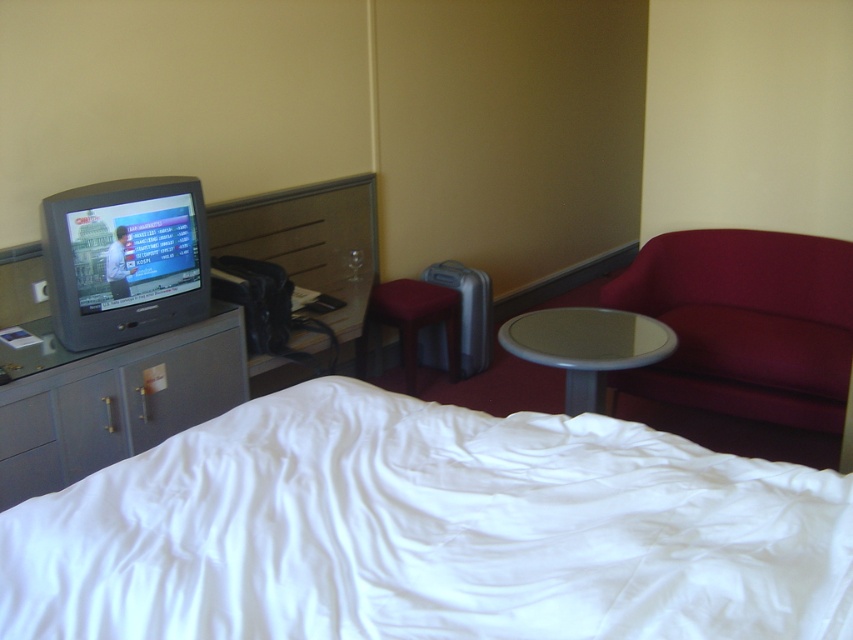
Question: Does burgundy fabric swivel chair at right have a larger size compared to velvet-like burgundy stool at center?

Choices:
 (A) yes
 (B) no

Answer: (A)

Question: Does burgundy fabric swivel chair at right appear on the left side of gray matte/file cabinet at left?

Choices:
 (A) yes
 (B) no

Answer: (B)

Question: Which object is closer to the camera taking this photo?

Choices:
 (A) gray matte/file cabinet at left
 (B) velvet-like burgundy stool at center
 (C) matte gray table at center

Answer: (A)

Question: Does white fabric bed at lower center appear on the left side of gray matte/file cabinet at left?

Choices:
 (A) yes
 (B) no

Answer: (B)

Question: Which point appears farthest from the camera in this image?

Choices:
 (A) (393, 324)
 (B) (790, 392)

Answer: (A)

Question: Which object appears closest to the camera in this image?

Choices:
 (A) burgundy fabric swivel chair at right
 (B) gray matte/file cabinet at left

Answer: (B)